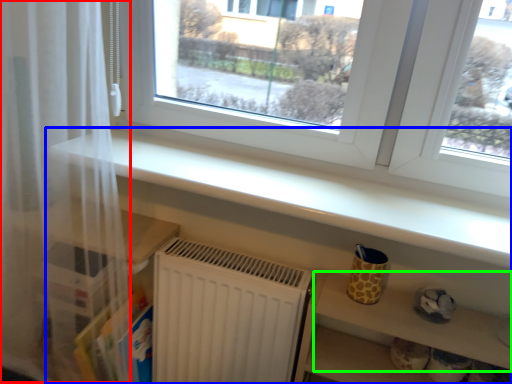
Question: Which object is positioned farthest from curtain (highlighted by a red box)? Select from shelf (highlighted by a blue box) and shelf (highlighted by a green box).

Choices:
 (A) shelf
 (B) shelf

Answer: (B)